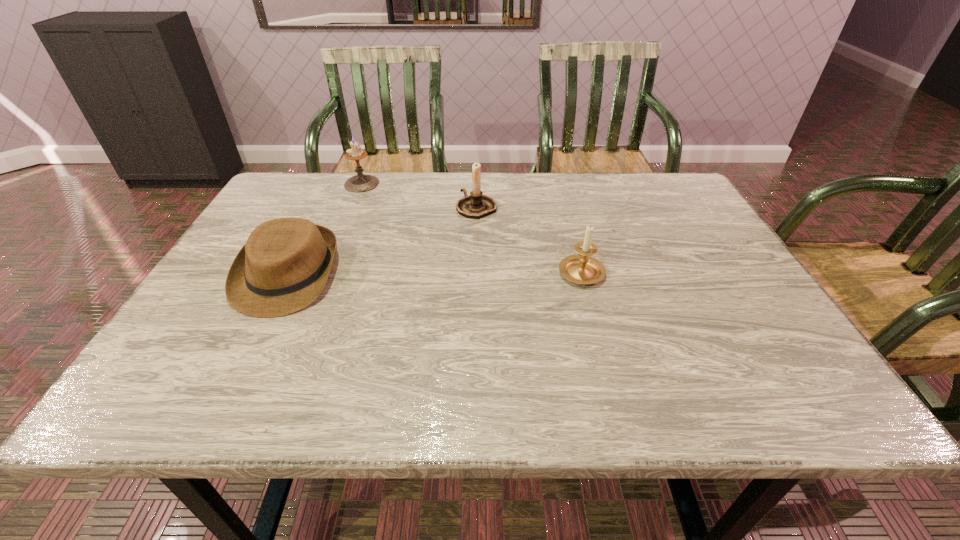
Locate which object is the second closest to the leftmost candle holder. Please provide its 2D coordinates. Your answer should be formatted as a tuple, i.e. [(x, y)], where the tuple contains the x and y coordinates of a point satisfying the conditions above.

[(477, 205)]

This screenshot has width=960, height=540. Find the location of `the third closest object to the fedora`. the third closest object to the fedora is located at coordinates (582, 269).

Image resolution: width=960 pixels, height=540 pixels. What are the coordinates of `candle holder that is the closest to the nearest candle holder` in the screenshot? It's located at (477, 205).

What are the coordinates of `candle holder identified as the closest to the shortest object` in the screenshot? It's located at click(359, 183).

Locate an element on the screen. This screenshot has width=960, height=540. vacant point that satisfies the following two spatial constraints: 1. on the front side of the second farthest candle holder; 2. on the left side of the farthest candle holder is located at coordinates (352, 207).